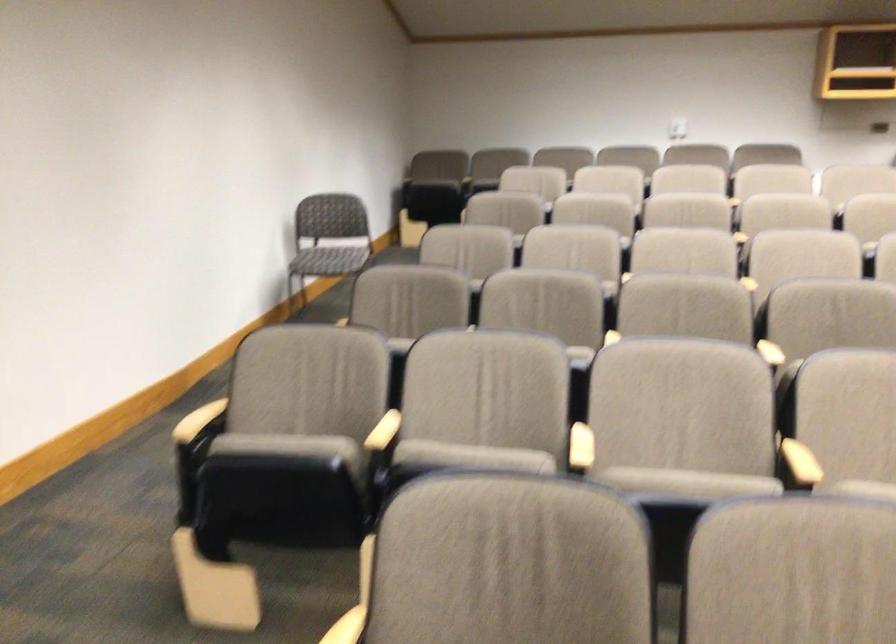
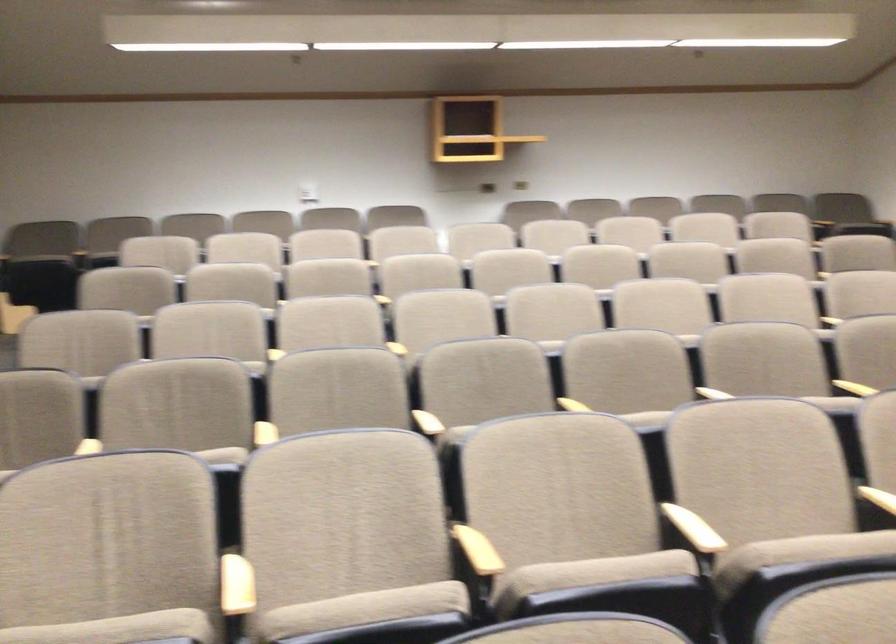
Question: Which direction would the cameraman need to move to produce the second image? Reply with the corresponding letter.

Choices:
 (A) Left
 (B) Right
 (C) Forward
 (D) Backward

Answer: (C)